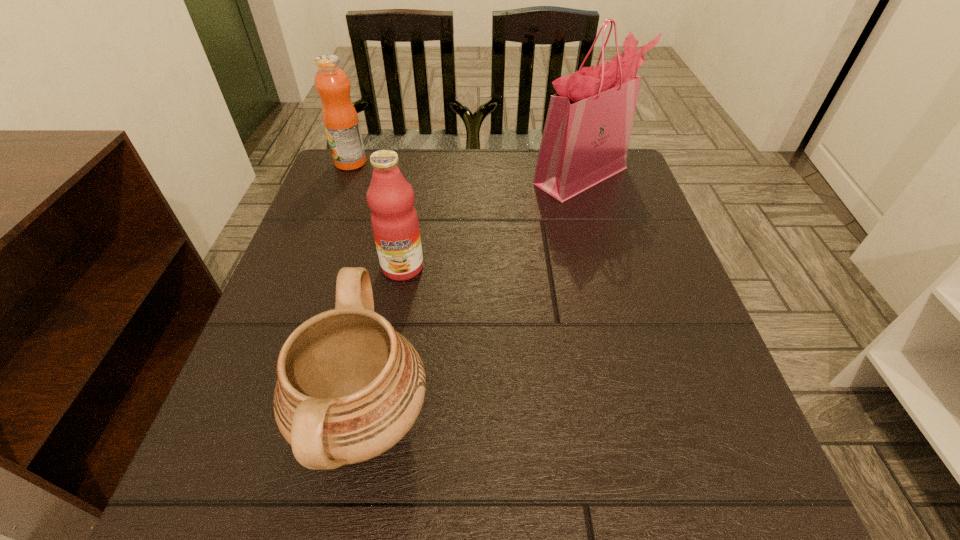
The height and width of the screenshot is (540, 960). Find the location of `object present at the far right corner`. object present at the far right corner is located at coordinates (586, 136).

The height and width of the screenshot is (540, 960). What are the coordinates of `free location at the far edge` in the screenshot? It's located at (508, 185).

I want to click on free space at the near edge of the desktop, so click(x=473, y=512).

The height and width of the screenshot is (540, 960). I want to click on vacant position at the left edge of the desktop, so click(252, 377).

Image resolution: width=960 pixels, height=540 pixels. Identify the location of free space at the right edge of the desktop. (629, 271).

Where is `free space at the far left corner of the desktop`? Image resolution: width=960 pixels, height=540 pixels. free space at the far left corner of the desktop is located at coordinates (368, 151).

Where is `vacant region at the far right corner of the desktop`? vacant region at the far right corner of the desktop is located at coordinates (634, 194).

I want to click on free location at the near right corner of the desktop, so click(x=684, y=482).

I want to click on vacant space that is in between the rightmost object and the second nearest object, so click(492, 221).

Where is `empty location between the farther fruit juice and the tallest object`? The image size is (960, 540). empty location between the farther fruit juice and the tallest object is located at coordinates (467, 169).